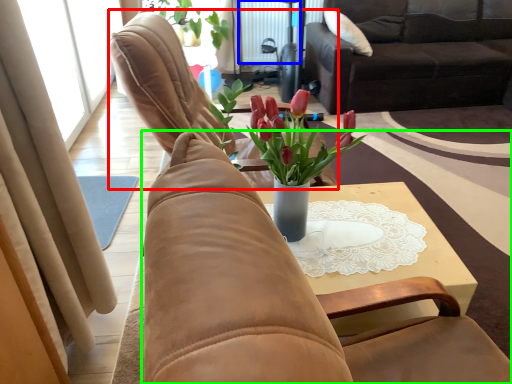
Question: Which object is positioned farthest from chair (highlighted by a red box)? Select from radiator (highlighted by a blue box) and chair (highlighted by a green box).

Choices:
 (A) radiator
 (B) chair

Answer: (A)